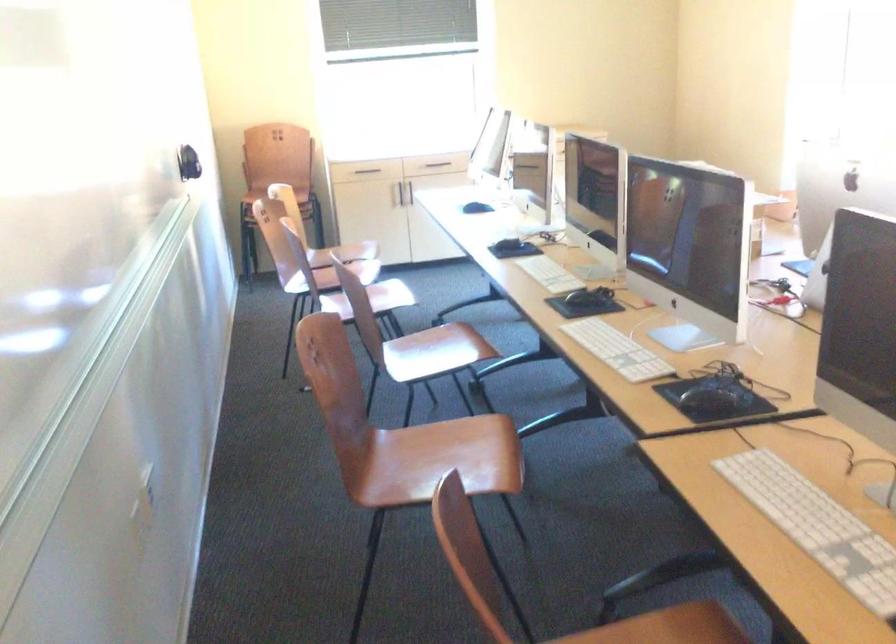
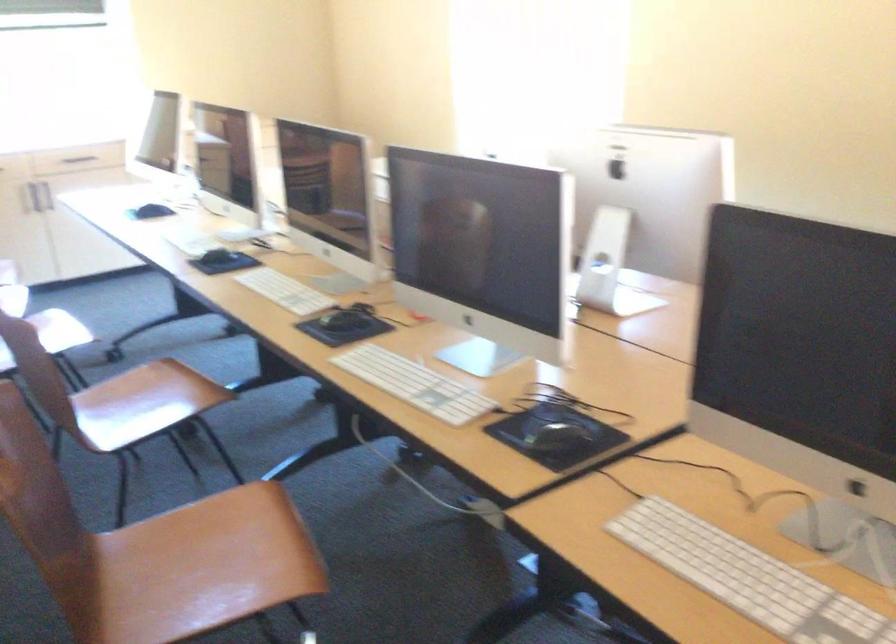
In the scene shown: In a continuous first-person perspective shot, in which direction is the camera moving?

The cameraman moved toward left, forward.